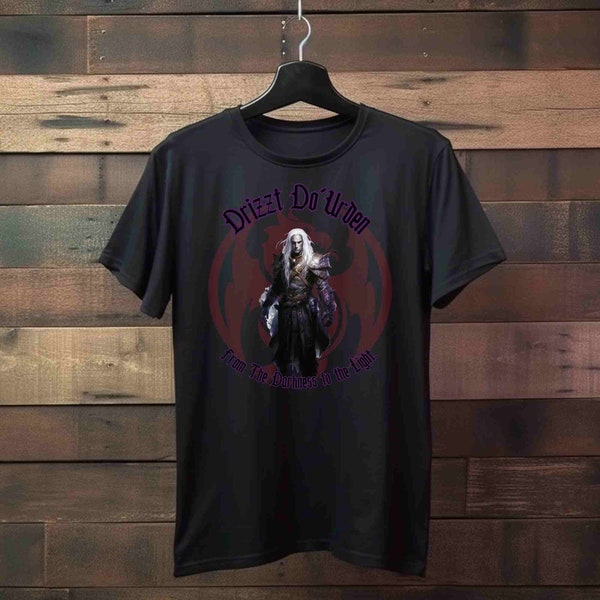
Find the location of a particular element. horizontal wooden boards is located at coordinates (88, 120).